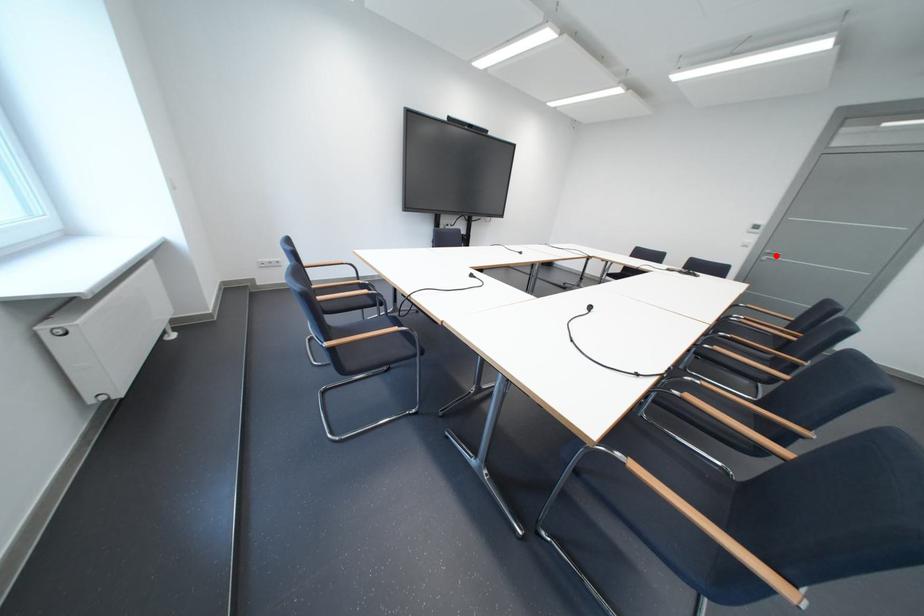
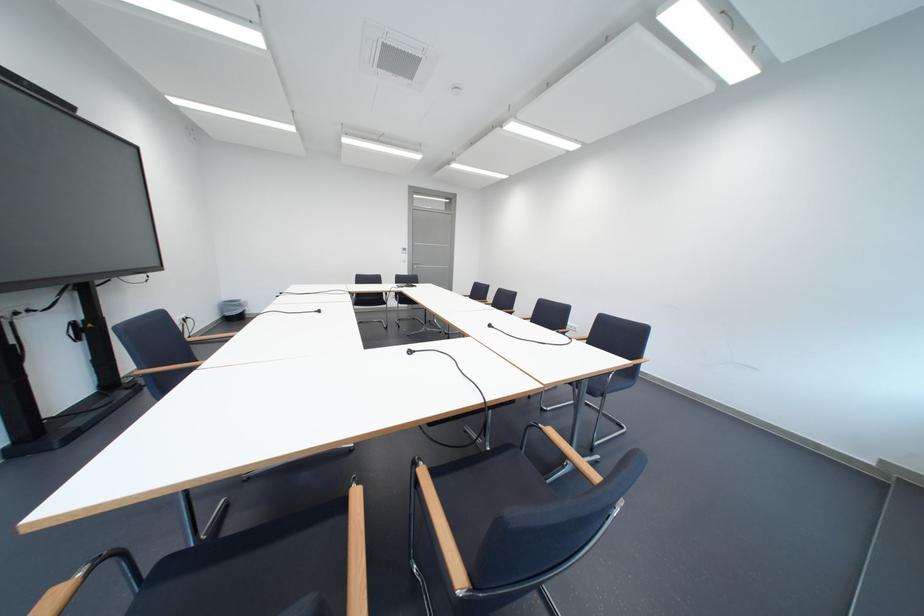
Where in the second image is the point corresponding to the highlighted location from the first image?

(426, 265)